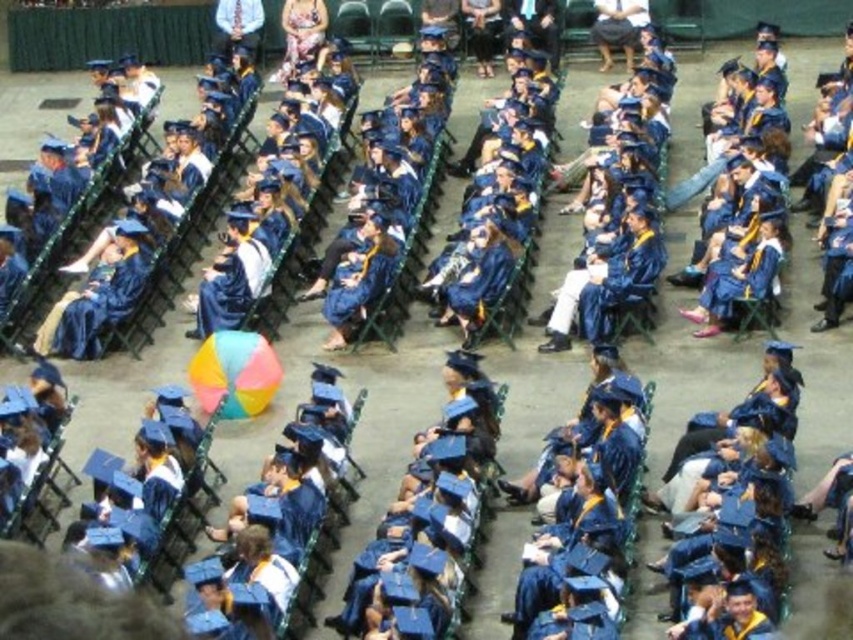
Question: Is matte blue gown at left wider than matte blue gown at center?

Choices:
 (A) no
 (B) yes

Answer: (B)

Question: Does matte blue gown at left come in front of matte blue gown at center?

Choices:
 (A) yes
 (B) no

Answer: (B)

Question: Can you confirm if matte blue gown at left is wider than matte blue gown at center?

Choices:
 (A) yes
 (B) no

Answer: (A)

Question: Which point is closer to the camera taking this photo?

Choices:
 (A) (96, 308)
 (B) (361, 300)

Answer: (B)